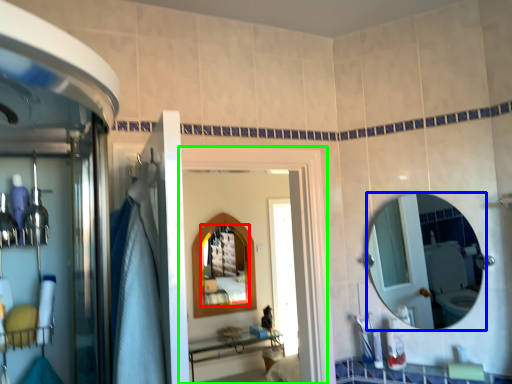
Question: Based on their relative distances, which object is nearer to mirror (highlighted by a red box)? Choose from mirror (highlighted by a blue box) and screen door (highlighted by a green box).

Choices:
 (A) mirror
 (B) screen door

Answer: (A)